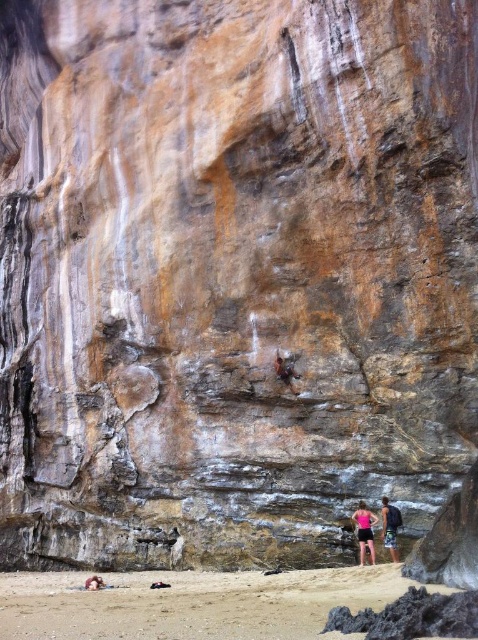
You are a hiker standing on the beach looking at the cliff. You see the smooth skin person at lower center and the rusty metal rock climber at center. Which object is closer to you?

The smooth skin person at lower center is closer to you because they are positioned under the rusty metal rock climber at center, meaning the climber is higher up on the cliff face.